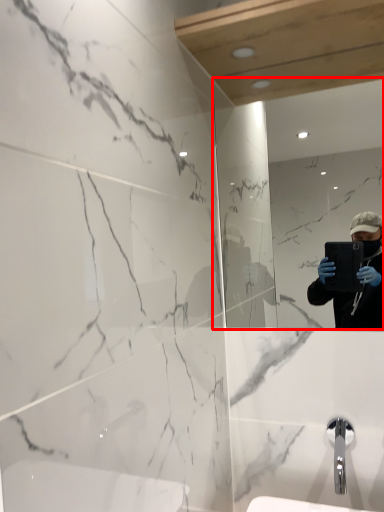
Question: Considering the relative positions of mirror (annotated by the red box) and tap in the image provided, where is mirror (annotated by the red box) located with respect to the staircase?

Choices:
 (A) left
 (B) right

Answer: (A)